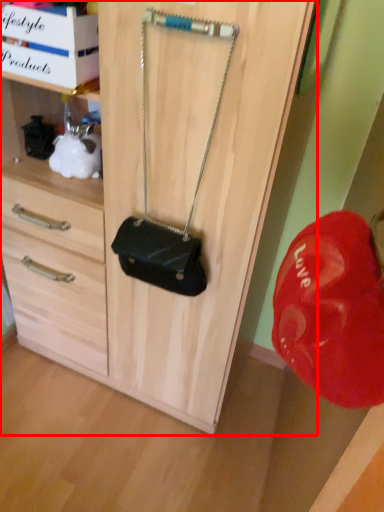
Question: From the image, what is the correct spatial relationship of cabinetry (annotated by the red box) in relation to handbag?

Choices:
 (A) right
 (B) left

Answer: (B)